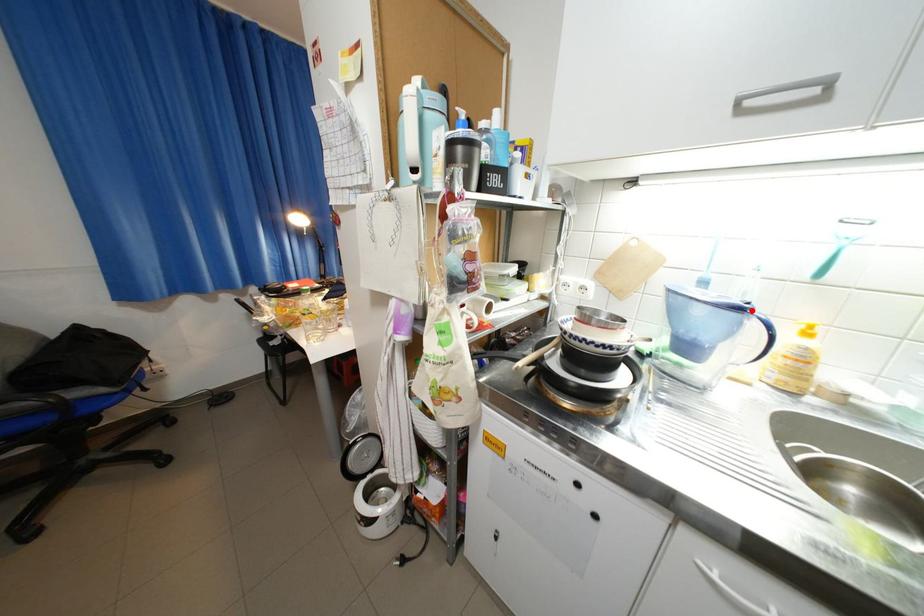
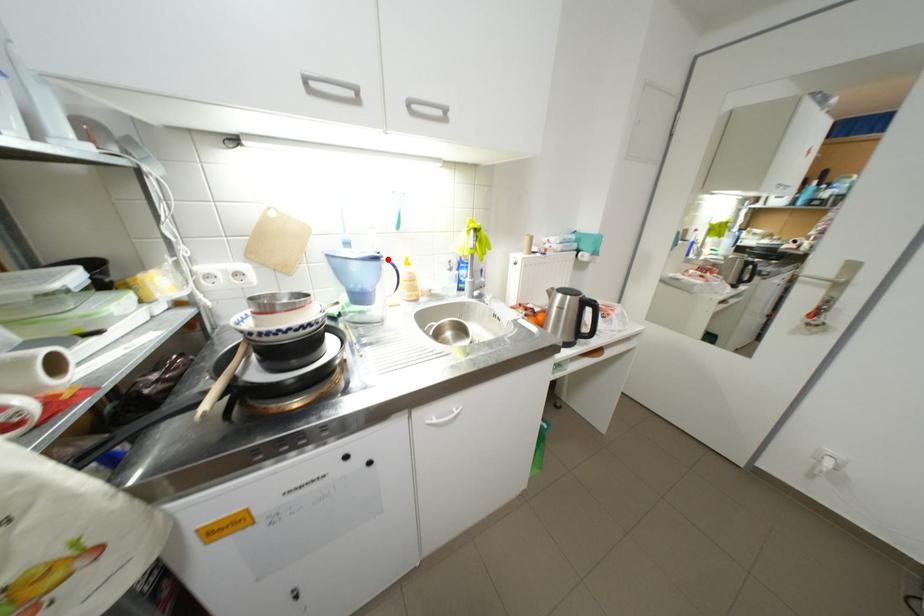
I am providing you with two images of the same scene from different viewpoints. A red point is marked on the first image and another point is marked on the second image. Does the point marked in image1 correspond to the same location as the one in image2?

Yes